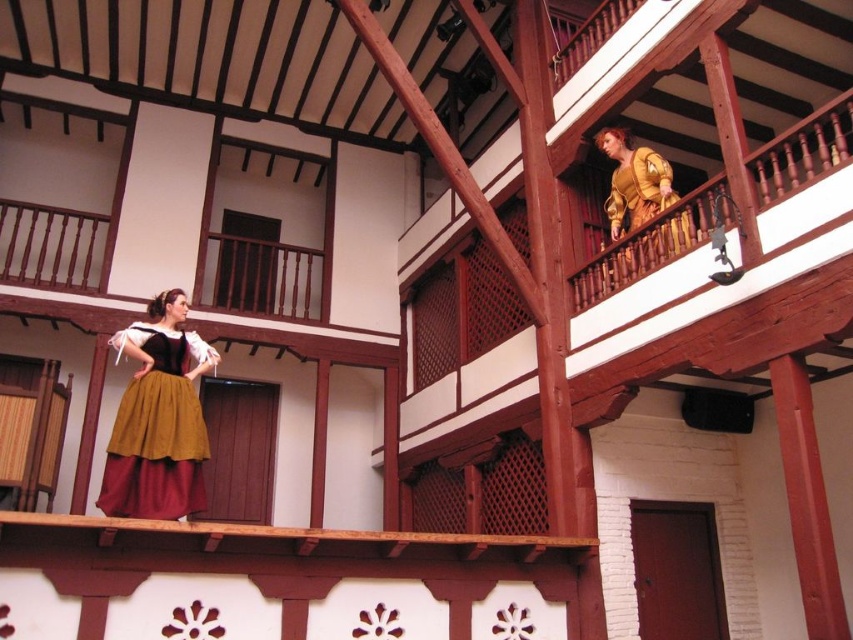
Question: Is matte gold skirt at center positioned at the back of golden-yellow fabric dress at upper right?

Choices:
 (A) yes
 (B) no

Answer: (B)

Question: Is matte gold skirt at center behind golden-yellow fabric dress at upper right?

Choices:
 (A) no
 (B) yes

Answer: (A)

Question: Is matte gold skirt at center further to the viewer compared to golden-yellow fabric dress at upper right?

Choices:
 (A) yes
 (B) no

Answer: (B)